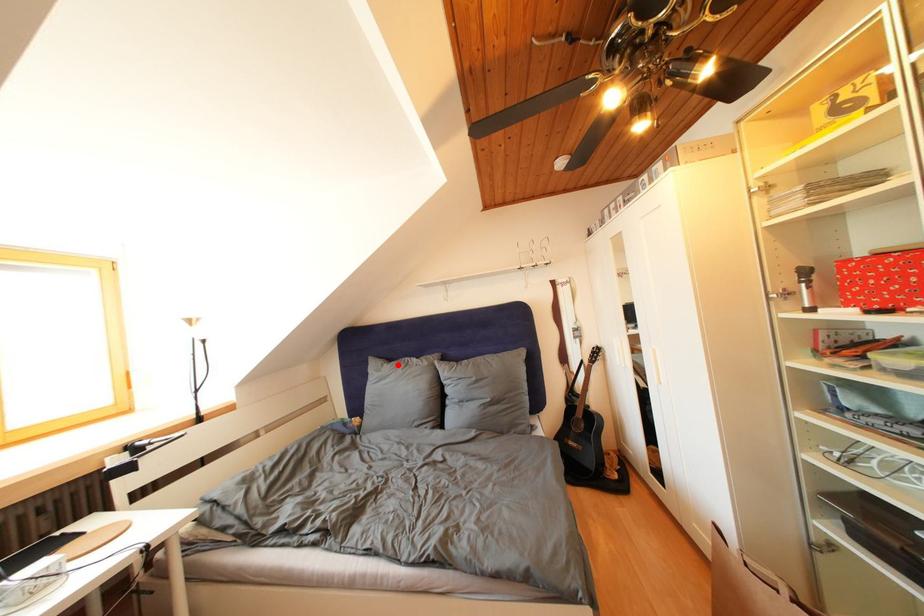
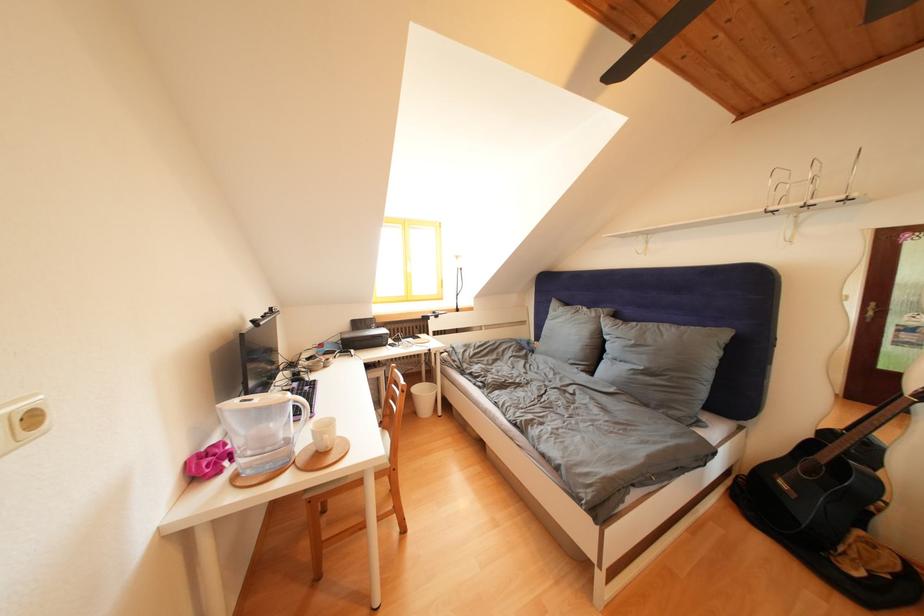
Find the pixel in the second image that matches the highlighted location in the first image.

(575, 310)